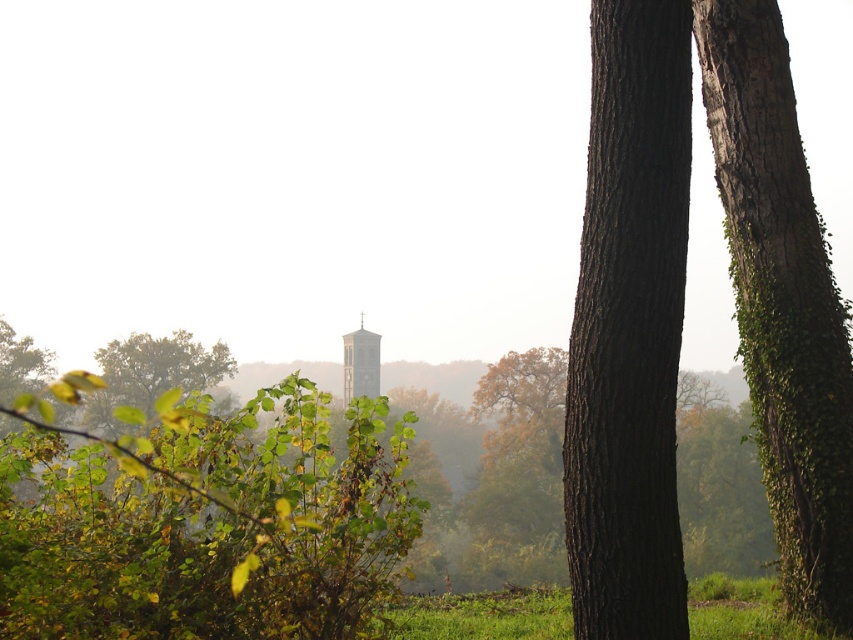
Is green rough bark tree trunk at right taller than green leafy tree at left?

Incorrect, green rough bark tree trunk at right's height is not larger of green leafy tree at left's.

Is the position of green rough bark tree trunk at right less distant than that of green leafy tree at left?

Yes, green rough bark tree trunk at right is closer to the viewer.

Is point (749, 70) closer to camera compared to point (207, 356)?

Yes.

Where is `green rough bark tree trunk at right`? green rough bark tree trunk at right is located at coordinates (782, 301).

Is dark brown textured tree trunk at right behind green grassy field at lower right?

No, it is not.

Which is in front, point (595, 422) or point (747, 579)?

Positioned in front is point (595, 422).

At what (x,y) coordinates should I click in order to perform the action: click on dark brown textured tree trunk at right. Please return your answer as a coordinate pair (x, y). This screenshot has height=640, width=853. Looking at the image, I should click on (630, 328).

Does green rough bark tree trunk at right have a lesser width compared to green grassy field at lower right?

Correct, green rough bark tree trunk at right's width is less than green grassy field at lower right's.

Which of these two, green rough bark tree trunk at right or green grassy field at lower right, stands taller?

green rough bark tree trunk at right

I want to click on green rough bark tree trunk at right, so click(782, 301).